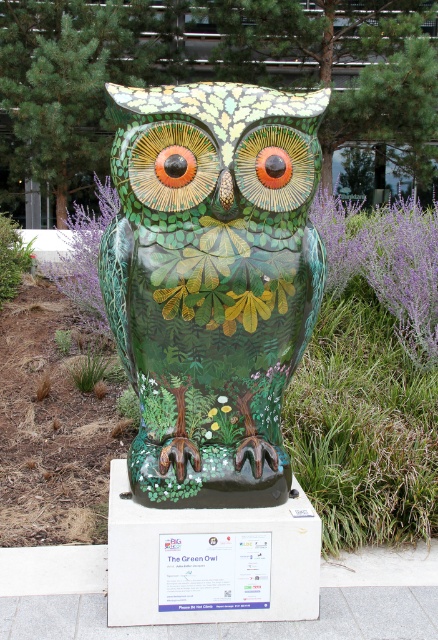
Is white fluffy flower at center above green matte flower at center?

Correct, white fluffy flower at center is located above green matte flower at center.

Can you confirm if white fluffy flower at center is taller than green matte flower at center?

Yes.

Measure the distance between point (223, 404) and camera.

A distance of 2.69 meters exists between point (223, 404) and camera.

Where is `white fluffy flower at center`? This screenshot has height=640, width=438. white fluffy flower at center is located at coordinates (226, 408).

Is shiny ceramic owl at center thinner than green glossy flower at center?

In fact, shiny ceramic owl at center might be wider than green glossy flower at center.

The width and height of the screenshot is (438, 640). Describe the element at coordinates (211, 282) in the screenshot. I see `shiny ceramic owl at center` at that location.

Image resolution: width=438 pixels, height=640 pixels. Identify the location of shiny ceramic owl at center. (211, 282).

Is shiny ceramic owl at center positioned behind purple fuzzy flower at center?

That is False.

Who is positioned more to the right, shiny ceramic owl at center or purple fuzzy flower at center?

shiny ceramic owl at center is more to the right.

Is point (208, 480) positioned before point (119, 205)?

Yes.

The width and height of the screenshot is (438, 640). I want to click on shiny ceramic owl at center, so [211, 282].